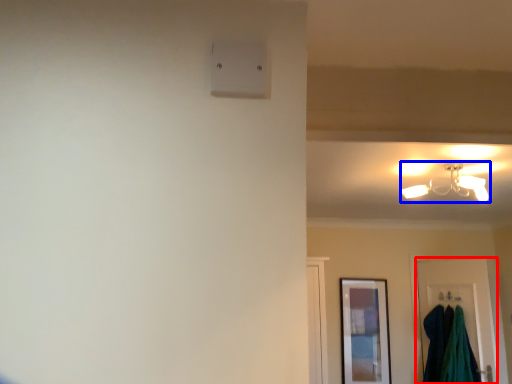
Question: Among these objects, which one is farthest to the camera, door (highlighted by a red box) or lamp (highlighted by a blue box)?

Choices:
 (A) door
 (B) lamp

Answer: (A)